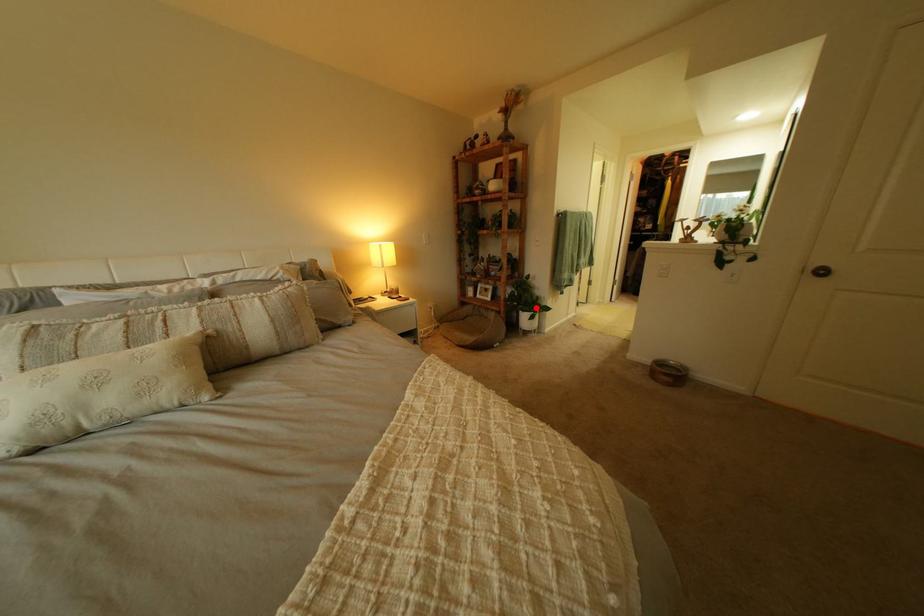
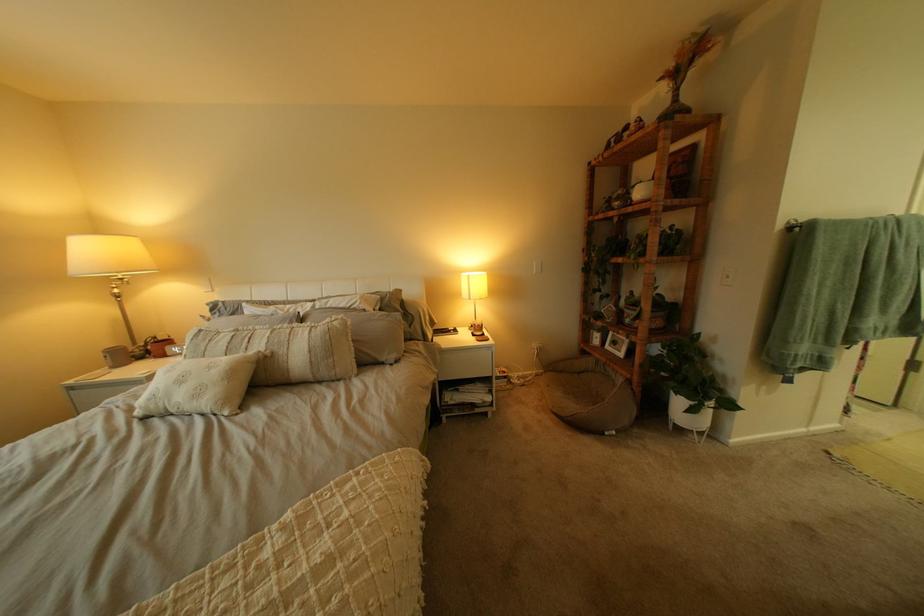
In the second image, find the point that corresponds to the highlighted location in the first image.

(687, 385)